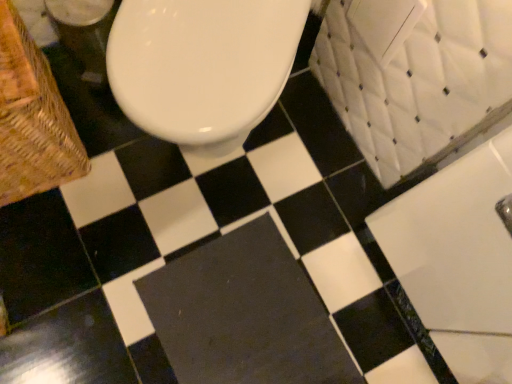
Question: From the image's perspective, is dark gray rubber bath mat at center located beneath white glossy bath at upper right?

Choices:
 (A) no
 (B) yes

Answer: (B)

Question: Considering the relative sizes of dark gray rubber bath mat at center and white glossy bath at upper right in the image provided, is dark gray rubber bath mat at center bigger than white glossy bath at upper right?

Choices:
 (A) no
 (B) yes

Answer: (A)

Question: Are dark gray rubber bath mat at center and white glossy bath at upper right located far from each other?

Choices:
 (A) yes
 (B) no

Answer: (B)

Question: From a real-world perspective, is dark gray rubber bath mat at center on top of white glossy bath at upper right?

Choices:
 (A) yes
 (B) no

Answer: (B)

Question: Is dark gray rubber bath mat at center turned away from white glossy bath at upper right?

Choices:
 (A) yes
 (B) no

Answer: (A)

Question: Considering the relative positions of dark gray rubber bath mat at center and white glossy bath at upper right in the image provided, is dark gray rubber bath mat at center to the left of white glossy bath at upper right from the viewer's perspective?

Choices:
 (A) no
 (B) yes

Answer: (B)

Question: From a real-world perspective, is dark gray rubber bath mat at center located higher than woven wood basket at left?

Choices:
 (A) yes
 (B) no

Answer: (B)

Question: Is dark gray rubber bath mat at center smaller than woven wood basket at left?

Choices:
 (A) no
 (B) yes

Answer: (B)

Question: Can you confirm if dark gray rubber bath mat at center is thinner than woven wood basket at left?

Choices:
 (A) no
 (B) yes

Answer: (B)

Question: From a real-world perspective, is dark gray rubber bath mat at center beneath woven wood basket at left?

Choices:
 (A) yes
 (B) no

Answer: (A)

Question: Considering the relative positions of dark gray rubber bath mat at center and woven wood basket at left in the image provided, is dark gray rubber bath mat at center in front of woven wood basket at left?

Choices:
 (A) no
 (B) yes

Answer: (A)

Question: From the image's perspective, does dark gray rubber bath mat at center appear higher than woven wood basket at left?

Choices:
 (A) yes
 (B) no

Answer: (B)

Question: From a real-world perspective, is white glossy bath at upper right physically below dark gray rubber bath mat at center?

Choices:
 (A) yes
 (B) no

Answer: (B)